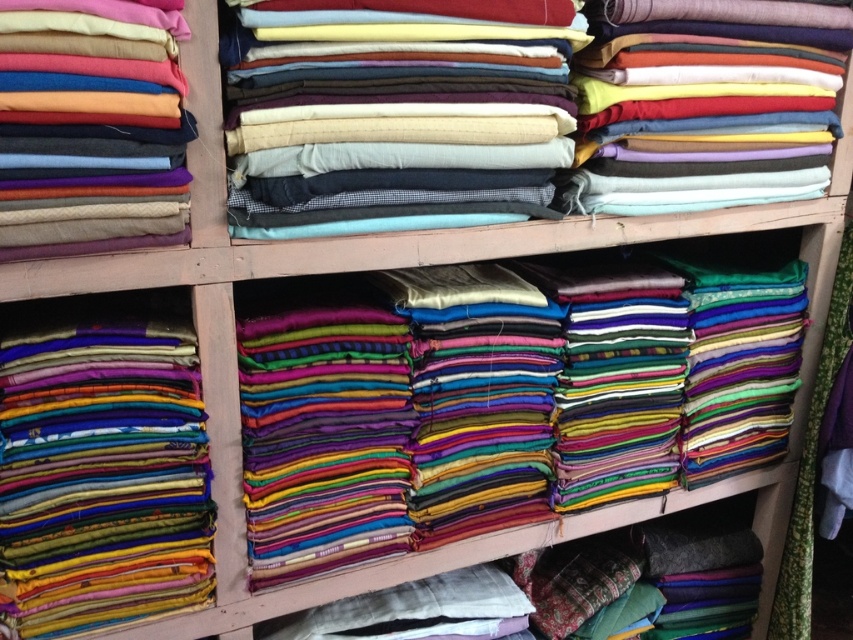
You are an interior designer who needs to place a 30 cm wide decorative item between the shiny silk fabric at lower left and the matte woolen fabric at left. Can you fit it there?

The distance between the shiny silk fabric at lower left and the matte woolen fabric at left is 26.39 centimeters. Since the decorative item is 30 cm wide, it cannot fit in the available space.

You are standing in front of the wooden shelving unit and see two points marked on the image. The first point is at coordinates point (425, 61) and the second is at point (51, 188). Which point is closer to you?

Point (51, 188) is closer to you because it is less further to the camera than point (425, 61).

You are organizing a fabric store and need to place a new display. You have two fabrics to arrange on the shelf. The shiny silk fabric at lower left and the matte woolen fabric at left. According to the existing arrangement, where should you place each fabric to maintain the current layout?

To maintain the current layout, the shiny silk fabric at lower left should be placed under the matte woolen fabric at left, as it is positioned under it in the existing arrangement.